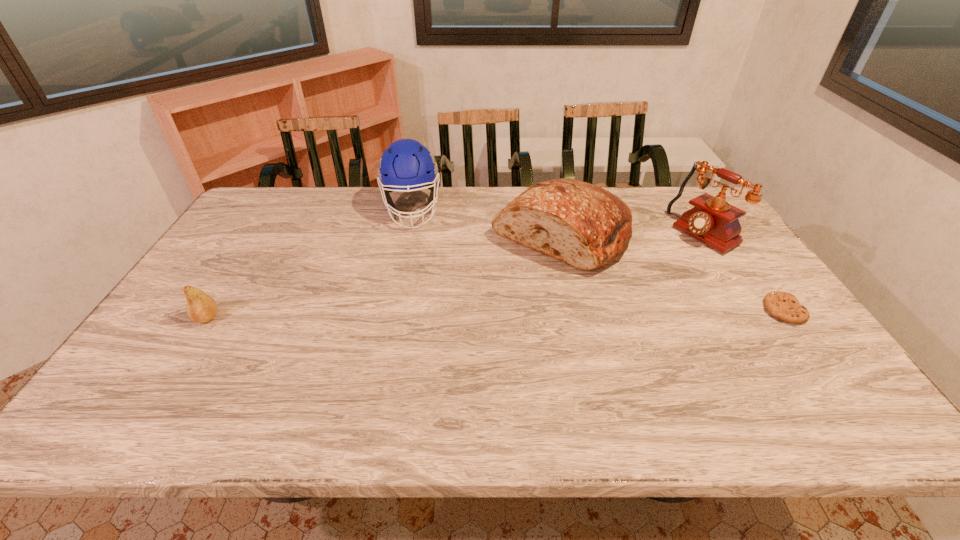
The image size is (960, 540). Find the location of `free spot between the leftmost object and the third object from left to right`. free spot between the leftmost object and the third object from left to right is located at coordinates (384, 276).

Identify the location of empty location between the shortest object and the telephone. The image size is (960, 540). (743, 272).

This screenshot has height=540, width=960. I want to click on unoccupied position between the telephone and the leftmost object, so click(455, 275).

Locate an element on the screen. This screenshot has width=960, height=540. vacant area that lies between the fourth tallest object and the shortest object is located at coordinates (495, 314).

Where is `vacant space in between the pear and the telephone`? vacant space in between the pear and the telephone is located at coordinates (455, 275).

Locate which object ranks in proximity to the fourth tallest object. Please provide its 2D coordinates. Your answer should be formatted as a tuple, i.e. [(x, y)], where the tuple contains the x and y coordinates of a point satisfying the conditions above.

[(406, 164)]

I want to click on object that can be found as the closest to the bread, so click(713, 221).

What are the coordinates of `free region that satisfies the following two spatial constraints: 1. on the front side of the cookie; 2. on the right side of the third object from right to left` in the screenshot? It's located at (578, 310).

The width and height of the screenshot is (960, 540). I want to click on free space that satisfies the following two spatial constraints: 1. on the back side of the football helmet; 2. on the left side of the leftmost object, so click(x=276, y=210).